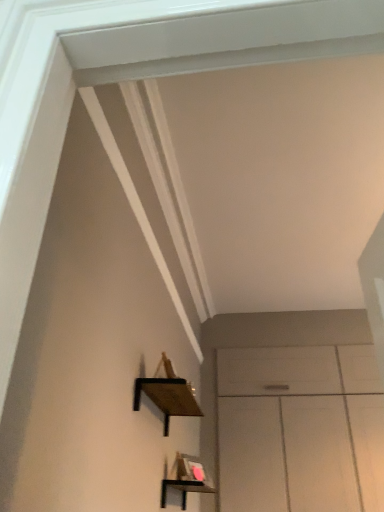
Question: Are black wood shelf at lower center, positioned as the 2th shelf in top-to-bottom order, and wooden at left, which is the 2th shelf from bottom to top, far apart?

Choices:
 (A) yes
 (B) no

Answer: (B)

Question: Is black wood shelf at lower center, placed as the first shelf when sorted from bottom to top, aimed at wooden at left, which is the 2th shelf from bottom to top?

Choices:
 (A) yes
 (B) no

Answer: (B)

Question: Would you say black wood shelf at lower center, positioned as the 2th shelf in top-to-bottom order, is outside wooden at left, which ranks as the first shelf in top-to-bottom order?

Choices:
 (A) yes
 (B) no

Answer: (A)

Question: Is the surface of black wood shelf at lower center, positioned as the 2th shelf in top-to-bottom order, in direct contact with wooden at left, which is the 2th shelf from bottom to top?

Choices:
 (A) no
 (B) yes

Answer: (A)

Question: Is black wood shelf at lower center, placed as the first shelf when sorted from bottom to top, at the right side of wooden at left, which ranks as the first shelf in top-to-bottom order?

Choices:
 (A) no
 (B) yes

Answer: (B)

Question: From the image's perspective, would you say black wood shelf at lower center, placed as the first shelf when sorted from bottom to top, is positioned over wooden at left, which is the 2th shelf from bottom to top?

Choices:
 (A) no
 (B) yes

Answer: (A)

Question: From the image's perspective, is wooden at left, which is the 2th shelf from bottom to top, above black wood shelf at lower center, placed as the first shelf when sorted from bottom to top?

Choices:
 (A) yes
 (B) no

Answer: (A)

Question: Does wooden at left, which ranks as the first shelf in top-to-bottom order, have a larger size compared to black wood shelf at lower center, positioned as the 2th shelf in top-to-bottom order?

Choices:
 (A) no
 (B) yes

Answer: (A)

Question: Is wooden at left, which is the 2th shelf from bottom to top, to the right of black wood shelf at lower center, placed as the first shelf when sorted from bottom to top, from the viewer's perspective?

Choices:
 (A) no
 (B) yes

Answer: (A)

Question: Would you say wooden at left, which is the 2th shelf from bottom to top, is a long distance from black wood shelf at lower center, placed as the first shelf when sorted from bottom to top?

Choices:
 (A) no
 (B) yes

Answer: (A)

Question: Would you say black wood shelf at lower center, positioned as the 2th shelf in top-to-bottom order, is part of wooden at left, which is the 2th shelf from bottom to top,'s contents?

Choices:
 (A) no
 (B) yes

Answer: (A)

Question: Is wooden at left, which ranks as the first shelf in top-to-bottom order, looking in the opposite direction of black wood shelf at lower center, positioned as the 2th shelf in top-to-bottom order?

Choices:
 (A) yes
 (B) no

Answer: (B)

Question: Choose the correct answer: Is wooden at left, which is the 2th shelf from bottom to top, inside black wood shelf at lower center, placed as the first shelf when sorted from bottom to top, or outside it?

Choices:
 (A) inside
 (B) outside

Answer: (B)